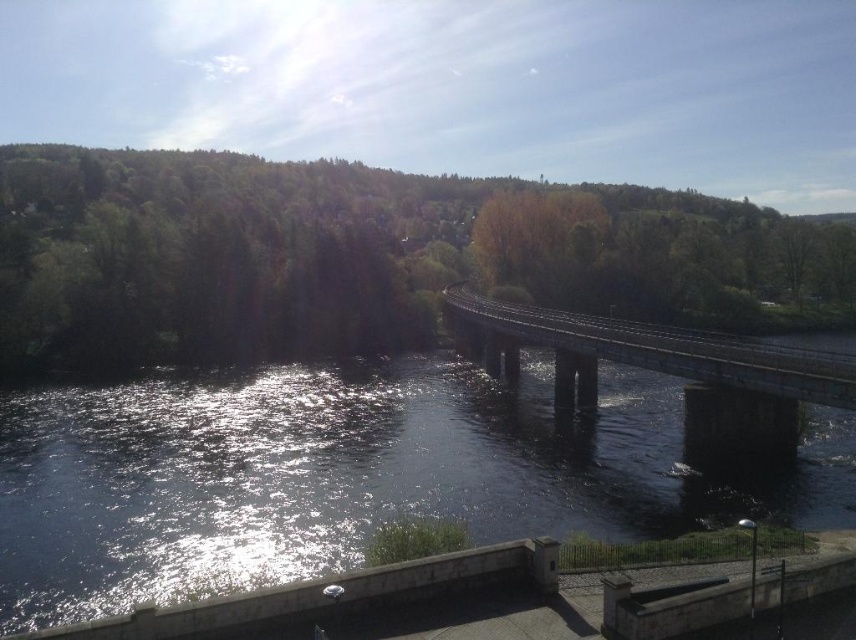
Question: Considering the relative positions of dark blue water at center and dark gray concrete bridge at center in the image provided, where is dark blue water at center located with respect to dark gray concrete bridge at center?

Choices:
 (A) below
 (B) above

Answer: (A)

Question: Does dark blue water at center appear on the right side of dark gray concrete bridge at center?

Choices:
 (A) yes
 (B) no

Answer: (B)

Question: Among these points, which one is farthest from the camera?

Choices:
 (A) (580, 380)
 (B) (673, 401)

Answer: (B)

Question: Among these points, which one is nearest to the camera?

Choices:
 (A) (70, 573)
 (B) (795, 348)

Answer: (A)

Question: Where is dark blue water at center located in relation to dark gray concrete bridge at center in the image?

Choices:
 (A) left
 (B) right

Answer: (A)